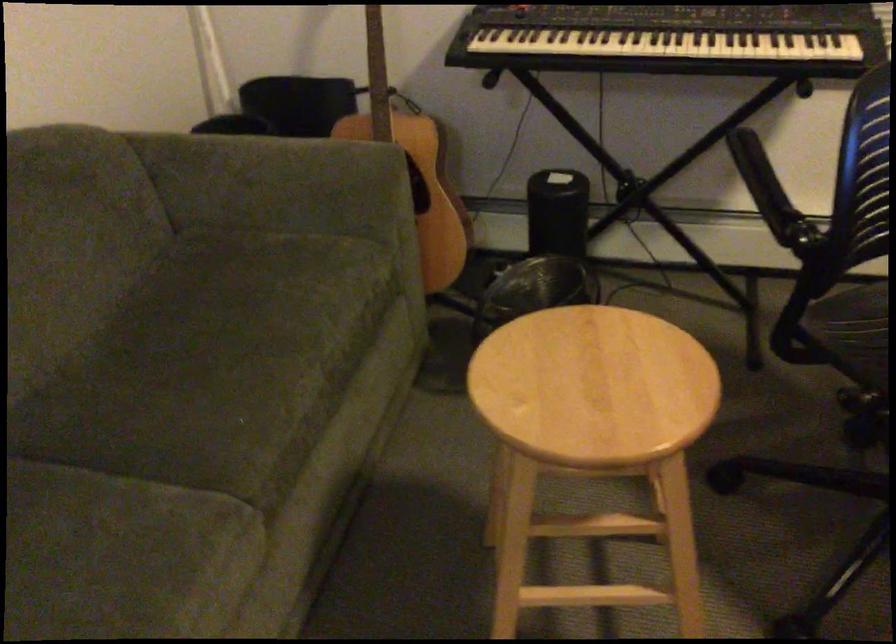
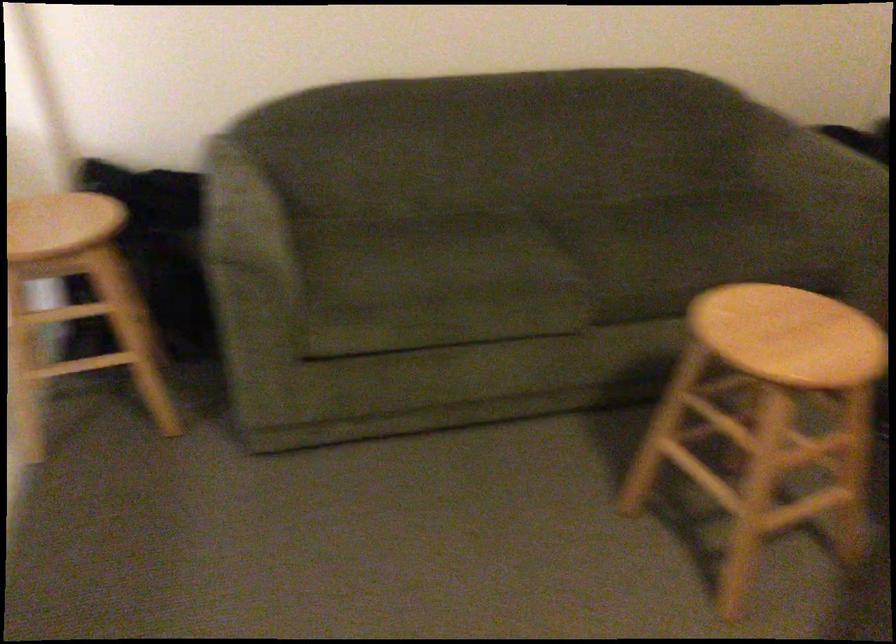
Locate, in the second image, the point that corresponds to pixel 128 529 in the first image.

(530, 261)